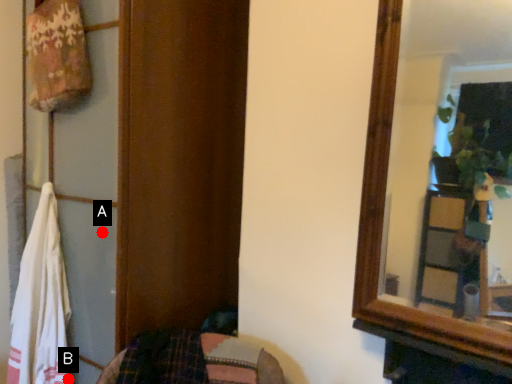
Question: Two points are circled on the image, labeled by A and B beside each circle. Among these points, which one is farthest from the camera?

Choices:
 (A) A is further
 (B) B is further

Answer: (B)